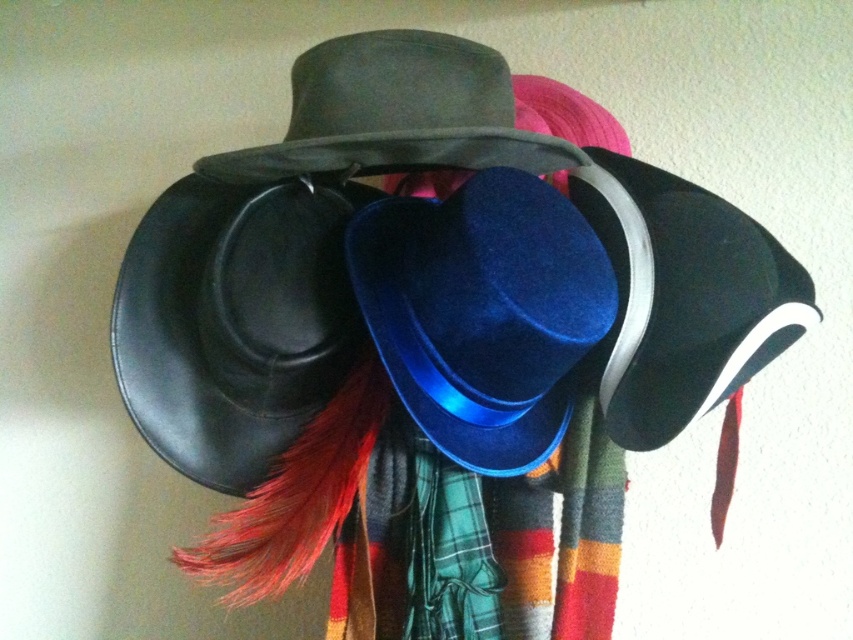
You are a customer looking to buy a hat. You see the velvet blue cowboy hat at center and the matte black fedora at center. Which one is located to the right of the other?

The velvet blue cowboy hat at center is positioned on the right side of the matte black fedora at center.

You are a customer trying to choose between two hats displayed in a store. You want to know which hat is narrower. The velvet blue cowboy hat at center and the matte black fedora at center are both options. Which one is narrower?

The velvet blue cowboy hat at center has a lesser width compared to the matte black fedora at center, so the velvet blue cowboy hat at center is narrower.

Looking at this image, you are an interior designer arranging a hat display. You want to ensure that the matte black fedora at center is visible from the front. Should you move the velvet blue cowboy hat at center closer to the viewer or further away?

The matte black fedora at center is currently behind the velvet blue cowboy hat at center. To make the matte black fedora at center visible from the front, you should move the velvet blue cowboy hat at center further away from the viewer, creating space between them so the matte black fedora at center can be seen in front.